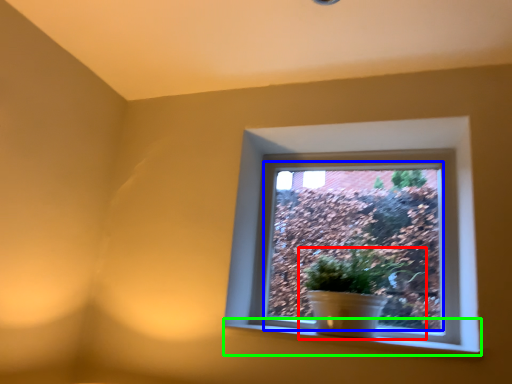
Question: Based on their relative distances, which object is nearer to houseplant (highlighted by a red box)? Choose from window screen (highlighted by a blue box) and window sill (highlighted by a green box).

Choices:
 (A) window screen
 (B) window sill

Answer: (A)